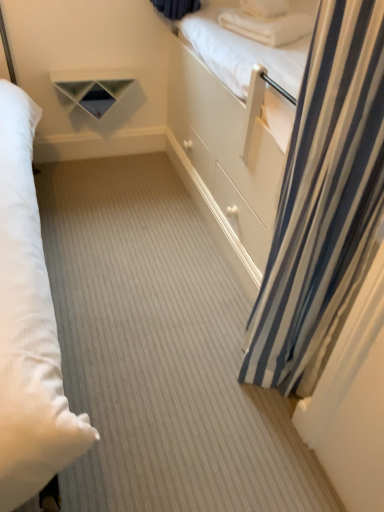
Measure the distance between point (293, 37) and camera.

They are 6.25 feet apart.

The height and width of the screenshot is (512, 384). Describe the element at coordinates (96, 89) in the screenshot. I see `white matte shelf at upper center` at that location.

This screenshot has height=512, width=384. What do you see at coordinates (323, 200) in the screenshot?
I see `blue striped curtain at right` at bounding box center [323, 200].

Where is `white soft pillow at upper right, which appears as the second pillow when ordered from the bottom`? white soft pillow at upper right, which appears as the second pillow when ordered from the bottom is located at coordinates (264, 8).

Between white matte shelf at upper center and blue striped curtain at right, which one has smaller width?

Thinner between the two is white matte shelf at upper center.

From the image's perspective, which is above, white matte shelf at upper center or blue striped curtain at right?

From the image's view, white matte shelf at upper center is above.

Is point (111, 105) closer to viewer compared to point (329, 115)?

No.

From a real-world perspective, which object rests below the other?

In real-world perspective, white matte shelf at upper center is lower.

Identify the location of curtain in front of the white matte shelf at upper center. (323, 200).

Between blue striped curtain at right and white matte shelf at upper center, which one is positioned behind?

white matte shelf at upper center.

From a real-world perspective, is blue striped curtain at right on top of white matte shelf at upper center?

Yes, from a real-world perspective, blue striped curtain at right is over white matte shelf at upper center

Considering the positions of objects white matte shelf at upper center and white soft pillow at upper right, acting as the first pillow starting from the top, in the image provided, who is more to the right, white matte shelf at upper center or white soft pillow at upper right, acting as the first pillow starting from the top,?

white soft pillow at upper right, acting as the first pillow starting from the top, is more to the right.

Is there a large distance between white matte shelf at upper center and white soft pillow at upper right, acting as the first pillow starting from the top?

No, white matte shelf at upper center is in close proximity to white soft pillow at upper right, acting as the first pillow starting from the top.

Find the location of `the 2nd pillow above the white matte shelf at upper center (from the image's perspective)`. the 2nd pillow above the white matte shelf at upper center (from the image's perspective) is located at coordinates (264, 8).

Would you say white matte shelf at upper center contains white soft pillow at upper right, which ranks as the 1th pillow in bottom-to-top order?

Actually, white soft pillow at upper right, which ranks as the 1th pillow in bottom-to-top order, is outside white matte shelf at upper center.

How different are the orientations of white matte shelf at upper center and white soft pillow at upper right, which ranks as the 1th pillow in bottom-to-top order, in degrees?

The facing directions of white matte shelf at upper center and white soft pillow at upper right, which ranks as the 1th pillow in bottom-to-top order, are 27.8 degrees apart.

Is white matte shelf at upper center smaller than white soft pillow at upper right, which ranks as the 1th pillow in bottom-to-top order?

Actually, white matte shelf at upper center might be larger than white soft pillow at upper right, which ranks as the 1th pillow in bottom-to-top order.

Is white matte shelf at upper center oriented towards white soft pillow at upper right, the 2th pillow in the top-to-bottom sequence?

No, white matte shelf at upper center is not facing towards white soft pillow at upper right, the 2th pillow in the top-to-bottom sequence.

Considering the sizes of white soft pillow at upper right, the 2th pillow in the top-to-bottom sequence, and white soft pillow at upper right, acting as the first pillow starting from the top, in the image, is white soft pillow at upper right, the 2th pillow in the top-to-bottom sequence, wider or thinner than white soft pillow at upper right, acting as the first pillow starting from the top,?

In the image, white soft pillow at upper right, the 2th pillow in the top-to-bottom sequence, appears to be wider than white soft pillow at upper right, acting as the first pillow starting from the top.

In order to click on pillow beneath the white soft pillow at upper right, which appears as the second pillow when ordered from the bottom (from a real-world perspective) in this screenshot , I will do `click(268, 25)`.

Would you say white soft pillow at upper right, which appears as the second pillow when ordered from the bottom, is part of white soft pillow at upper right, which ranks as the 1th pillow in bottom-to-top order,'s contents?

Yes, white soft pillow at upper right, which appears as the second pillow when ordered from the bottom, is a part of white soft pillow at upper right, which ranks as the 1th pillow in bottom-to-top order.

Is point (280, 20) positioned after point (241, 7)?

No, (280, 20) is closer to viewer.

Where is `pillow that is the 1st one when counting upward from the blue striped curtain at right (from the image's perspective)`? pillow that is the 1st one when counting upward from the blue striped curtain at right (from the image's perspective) is located at coordinates (268, 25).

From the picture: Would you consider blue striped curtain at right to be distant from white soft pillow at upper right, the 2th pillow in the top-to-bottom sequence?

blue striped curtain at right is positioned a significant distance from white soft pillow at upper right, the 2th pillow in the top-to-bottom sequence.

From a real-world perspective, is blue striped curtain at right physically located above or below white soft pillow at upper right, the 2th pillow in the top-to-bottom sequence?

blue striped curtain at right is situated lower than white soft pillow at upper right, the 2th pillow in the top-to-bottom sequence, in the real world.

Which of these two, blue striped curtain at right or white soft pillow at upper right, the 2th pillow in the top-to-bottom sequence, is wider?

With larger width is white soft pillow at upper right, the 2th pillow in the top-to-bottom sequence.

From a real-world perspective, which object rests below the other?

In real-world perspective, blue striped curtain at right is lower.

How different are the orientations of white soft pillow at upper right, the 2th pillow in the top-to-bottom sequence, and blue striped curtain at right in degrees?

117 degrees separate the facing orientations of white soft pillow at upper right, the 2th pillow in the top-to-bottom sequence, and blue striped curtain at right.

Considering the positions of objects white soft pillow at upper right, the 2th pillow in the top-to-bottom sequence, and blue striped curtain at right in the image provided, who is in front, white soft pillow at upper right, the 2th pillow in the top-to-bottom sequence, or blue striped curtain at right?

blue striped curtain at right is more forward.

Is white soft pillow at upper right, the 2th pillow in the top-to-bottom sequence, positioned with its back to blue striped curtain at right?

white soft pillow at upper right, the 2th pillow in the top-to-bottom sequence, is not turned away from blue striped curtain at right.

This screenshot has width=384, height=512. In order to click on shelf above the blue striped curtain at right (from the image's perspective) in this screenshot , I will do `click(96, 89)`.

Locate an element on the screen. curtain in front of the white matte shelf at upper center is located at coordinates (323, 200).

Considering their positions, is white matte shelf at upper center positioned further to white soft pillow at upper right, which appears as the second pillow when ordered from the bottom, than blue striped curtain at right?

blue striped curtain at right is further to white soft pillow at upper right, which appears as the second pillow when ordered from the bottom.

Considering their positions, is white matte shelf at upper center positioned further to white soft pillow at upper right, the 2th pillow in the top-to-bottom sequence, than blue striped curtain at right?

blue striped curtain at right is further to white soft pillow at upper right, the 2th pillow in the top-to-bottom sequence.

When comparing their distances from white soft pillow at upper right, the 2th pillow in the top-to-bottom sequence, does white soft pillow at upper right, which appears as the second pillow when ordered from the bottom, or white matte shelf at upper center seem further?

The object further to white soft pillow at upper right, the 2th pillow in the top-to-bottom sequence, is white matte shelf at upper center.

Looking at the image, which one is located further to blue striped curtain at right, white matte shelf at upper center or white soft pillow at upper right, the 2th pillow in the top-to-bottom sequence?

white matte shelf at upper center lies further to blue striped curtain at right than the other object.

Looking at the image, which one is located further to blue striped curtain at right, white soft pillow at upper right, which ranks as the 1th pillow in bottom-to-top order, or white matte shelf at upper center?

Among the two, white matte shelf at upper center is located further to blue striped curtain at right.

From the picture: Based on their spatial positions, is white soft pillow at upper right, which appears as the second pillow when ordered from the bottom, or blue striped curtain at right further from white matte shelf at upper center?

blue striped curtain at right lies further to white matte shelf at upper center than the other object.

Looking at the image, which one is located further to white matte shelf at upper center, blue striped curtain at right or white soft pillow at upper right, which appears as the second pillow when ordered from the bottom?

blue striped curtain at right.

Considering their positions, is blue striped curtain at right positioned closer to white soft pillow at upper right, which ranks as the 1th pillow in bottom-to-top order, than white soft pillow at upper right, acting as the first pillow starting from the top?

white soft pillow at upper right, acting as the first pillow starting from the top, is closer to white soft pillow at upper right, which ranks as the 1th pillow in bottom-to-top order.

Find the location of a particular element. The image size is (384, 512). pillow between blue striped curtain at right and white soft pillow at upper right, acting as the first pillow starting from the top, along the z-axis is located at coordinates (268, 25).

Identify the location of pillow between white matte shelf at upper center and white soft pillow at upper right, the 2th pillow in the top-to-bottom sequence, in the horizontal direction. Image resolution: width=384 pixels, height=512 pixels. (264, 8).